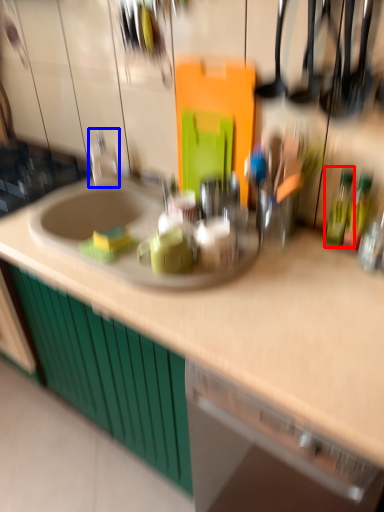
Question: Which object appears closest to the camera in this image, bottle (highlighted by a red box) or faucet (highlighted by a blue box)?

Choices:
 (A) bottle
 (B) faucet

Answer: (A)